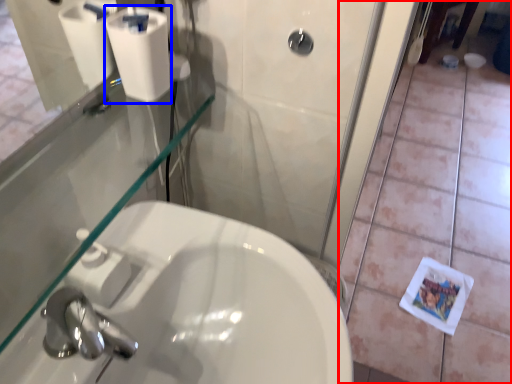
Question: Among these objects, which one is farthest to the camera, tile (highlighted by a red box) or toilet paper (highlighted by a blue box)?

Choices:
 (A) tile
 (B) toilet paper

Answer: (A)